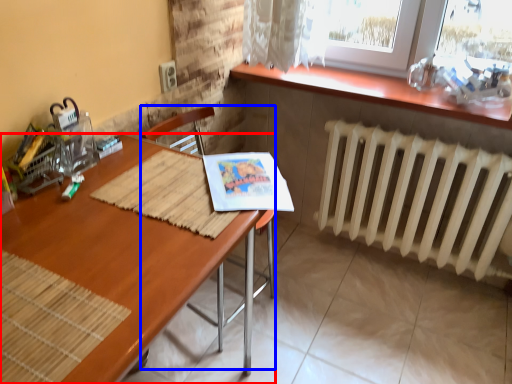
Question: Which point is further to the camera, desk (highlighted by a red box) or armchair (highlighted by a blue box)?

Choices:
 (A) desk
 (B) armchair

Answer: (B)